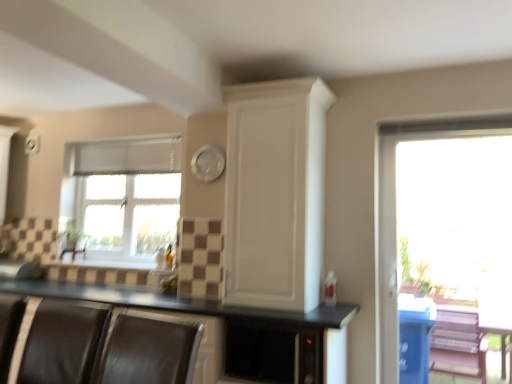
Question: Is black matte countertop at center wider or thinner than transparent glass window at right, the 2th window when ordered from left to right?

Choices:
 (A) wide
 (B) thin

Answer: (A)

Question: From the image's perspective, is black matte countertop at center located above or below transparent glass window at right, which appears as the 2th window when viewed from the back?

Choices:
 (A) below
 (B) above

Answer: (A)

Question: Which of these objects is positioned closest to the black matte countertop at center?

Choices:
 (A) brown leather armchair at lower left, the first armchair from the left
 (B) white matte cabinet at upper center
 (C) white textured window at left, arranged as the 2th window when viewed from the right
 (D) black leather armchair at lower left, positioned as the 2th armchair in left-to-right order
 (E) transparent glass window at right, which ranks as the 1th window in front-to-back order

Answer: (B)

Question: Based on their relative distances, which object is farther from the black matte countertop at center?

Choices:
 (A) black leather armchair at lower left, which is counted as the first armchair, starting from the right
 (B) brown leather armchair at lower left, the first armchair from the back
 (C) white matte cabinet at upper center
 (D) white fabric blind at upper left
 (E) transparent glass window at right, which ranks as the 1th window in front-to-back order

Answer: (E)